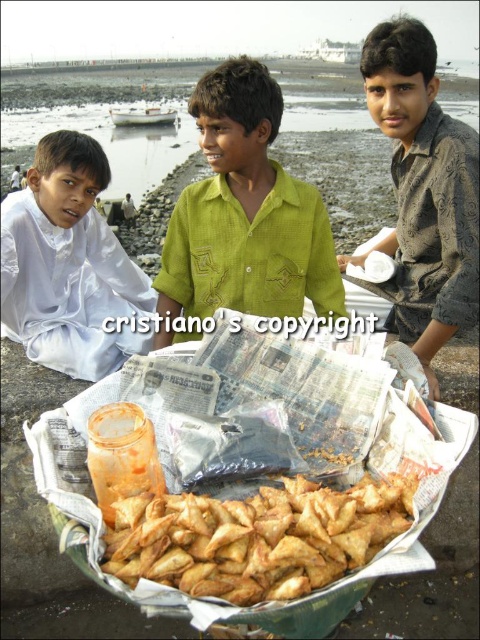
Question: Which point is closer to the camera taking this photo?

Choices:
 (A) (228, 93)
 (B) (105, 273)
 (C) (387, 125)

Answer: (A)

Question: Is green textured shirt at center to the left of patterned brown shirt at right from the viewer's perspective?

Choices:
 (A) yes
 (B) no

Answer: (A)

Question: Which point is closer to the camera?

Choices:
 (A) (72, 237)
 (B) (409, 252)

Answer: (B)

Question: Among these objects, which one is farthest from the camera?

Choices:
 (A) golden crispy samosa at center
 (B) green textured shirt at center
 (C) white matte cloth at left

Answer: (C)

Question: Does patterned brown shirt at right appear on the left side of white matte cloth at left?

Choices:
 (A) yes
 (B) no

Answer: (B)

Question: Is green textured shirt at center to the left of patterned brown shirt at right from the viewer's perspective?

Choices:
 (A) no
 (B) yes

Answer: (B)